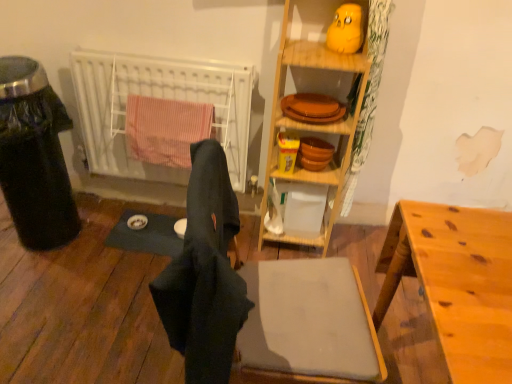
Locate an element on the screen. This screenshot has height=384, width=512. orange matte tray at center is located at coordinates (312, 108).

Find the location of a particular element. white matte radiator at left is located at coordinates (158, 97).

The height and width of the screenshot is (384, 512). Describe the element at coordinates (146, 235) in the screenshot. I see `dark gray fabric yoga mat at center` at that location.

This screenshot has width=512, height=384. Describe the element at coordinates (346, 29) in the screenshot. I see `yellow matte rubber duck at upper center` at that location.

Describe the element at coordinates (311, 124) in the screenshot. This screenshot has width=512, height=384. I see `wooden shelf at upper center` at that location.

Image resolution: width=512 pixels, height=384 pixels. In order to click on matte orange plates at upper center in this screenshot , I will do `click(313, 123)`.

From the image's perspective, is wooden shelf at upper center over dark gray fabric yoga mat at center?

Yes.

Considering the positions of points (302, 12) and (166, 236), is point (302, 12) closer to camera compared to point (166, 236)?

Yes, point (302, 12) is in front of point (166, 236).

Considering the positions of objects wooden shelf at upper center and dark gray fabric yoga mat at center in the image provided, who is more to the left, wooden shelf at upper center or dark gray fabric yoga mat at center?

Positioned to the left is dark gray fabric yoga mat at center.

Is wooden shelf at upper center situated inside dark gray fabric yoga mat at center or outside?

wooden shelf at upper center lies outside dark gray fabric yoga mat at center.

Is yellow matte rubber duck at upper center aimed at dark gray fabric yoga mat at center?

No, yellow matte rubber duck at upper center is not aimed at dark gray fabric yoga mat at center.

Are yellow matte rubber duck at upper center and dark gray fabric yoga mat at center far apart?

yellow matte rubber duck at upper center is far away from dark gray fabric yoga mat at center.

How different are the orientations of yellow matte rubber duck at upper center and dark gray fabric yoga mat at center in degrees?

They differ by 0.437 degrees in their facing directions.

From a real-world perspective, is yellow matte rubber duck at upper center on top of dark gray fabric yoga mat at center?

Yes.

Where is `desk below the wooden shelf at upper center (from the image's perspective)`? Image resolution: width=512 pixels, height=384 pixels. desk below the wooden shelf at upper center (from the image's perspective) is located at coordinates (456, 282).

Considering the points (469, 329) and (310, 26), which point is behind, point (469, 329) or point (310, 26)?

The point (310, 26) is farther.

Does light brown wooden desk at lower right have a smaller size compared to wooden shelf at upper center?

No.

Is light brown wooden desk at lower right to the left of wooden shelf at upper center from the viewer's perspective?

No, light brown wooden desk at lower right is not to the left of wooden shelf at upper center.

Which object is further away from the camera, wooden shelf at upper center or light brown wooden desk at lower right?

wooden shelf at upper center is more distant.

Looking at their sizes, would you say wooden shelf at upper center is wider or thinner than light brown wooden desk at lower right?

In the image, wooden shelf at upper center appears to be more narrow than light brown wooden desk at lower right.

Is wooden shelf at upper center at the right side of light brown wooden desk at lower right?

No.

Is wooden shelf at upper center directly adjacent to light brown wooden desk at lower right?

No.

Does wooden shelf at upper center turn towards transparent plastic trash can at left?

No, wooden shelf at upper center is not turned towards transparent plastic trash can at left.

Which object is positioned more to the right, wooden shelf at upper center or transparent plastic trash can at left?

From the viewer's perspective, wooden shelf at upper center appears more on the right side.

Which of these two, wooden shelf at upper center or transparent plastic trash can at left, stands taller?

wooden shelf at upper center is taller.

From the image's perspective, between wooden shelf at upper center and transparent plastic trash can at left, who is located below?

transparent plastic trash can at left.

Which object is more forward, dark fabric laundry at center or wooden shelf at upper center?

Positioned in front is dark fabric laundry at center.

From the image's perspective, between dark fabric laundry at center and wooden shelf at upper center, which one is located above?

From the image's view, wooden shelf at upper center is above.

Is dark fabric laundry at center spatially inside wooden shelf at upper center, or outside of it?

dark fabric laundry at center is not inside wooden shelf at upper center, it's outside.

Which of these two, dark fabric laundry at center or wooden shelf at upper center, is thinner?

With smaller width is dark fabric laundry at center.

Considering the sizes of dark gray fabric yoga mat at center and matte orange plates at upper center in the image, is dark gray fabric yoga mat at center taller or shorter than matte orange plates at upper center?

Clearly, dark gray fabric yoga mat at center is shorter compared to matte orange plates at upper center.

Considering the positions of objects dark gray fabric yoga mat at center and matte orange plates at upper center in the image provided, who is behind, dark gray fabric yoga mat at center or matte orange plates at upper center?

dark gray fabric yoga mat at center is more distant.

Considering the relative sizes of dark gray fabric yoga mat at center and matte orange plates at upper center in the image provided, is dark gray fabric yoga mat at center smaller than matte orange plates at upper center?

Yes.

Where is `yoga mat on the left of the wooden shelf at upper center`? This screenshot has width=512, height=384. yoga mat on the left of the wooden shelf at upper center is located at coordinates (146, 235).

Where is `toy located above the dark gray fabric yoga mat at center (from the image's perspective)`? toy located above the dark gray fabric yoga mat at center (from the image's perspective) is located at coordinates (346, 29).

Looking at the image, which one is located further to wooden shelf at upper center, transparent plastic trash can at left or light brown wooden desk at lower right?

transparent plastic trash can at left is positioned further to the anchor wooden shelf at upper center.

Consider the image. Estimate the real-world distances between objects in this image. Which object is closer to dark fabric laundry at center, yellow matte rubber duck at upper center or wooden shelf at upper center?

wooden shelf at upper center is positioned closer to the anchor dark fabric laundry at center.

Based on their spatial positions, is orange matte tray at center or white matte radiator at left closer to matte orange plates at upper center?

orange matte tray at center is positioned closer to the anchor matte orange plates at upper center.

Based on the photo, estimate the real-world distances between objects in this image. Which object is further from dark gray fabric yoga mat at center, white matte radiator at left or transparent plastic trash can at left?

white matte radiator at left is further to dark gray fabric yoga mat at center.

From the picture: Which object lies further to the anchor point white matte radiator at left, wooden shelf at upper center or yellow matte rubber duck at upper center?

The object further to white matte radiator at left is yellow matte rubber duck at upper center.

Estimate the real-world distances between objects in this image. Which object is closer to yellow matte rubber duck at upper center, matte orange plates at upper center or wooden shelf at upper center?

The object closer to yellow matte rubber duck at upper center is matte orange plates at upper center.

Based on their spatial positions, is light brown wooden desk at lower right or wooden shelf at upper center closer to white matte radiator at left?

Among the two, wooden shelf at upper center is located nearer to white matte radiator at left.

Estimate the real-world distances between objects in this image. Which object is further from dark gray fabric yoga mat at center, white matte radiator at left or light brown wooden desk at lower right?

light brown wooden desk at lower right lies further to dark gray fabric yoga mat at center than the other object.

Locate an element on the screen. The height and width of the screenshot is (384, 512). radiator situated between transparent plastic trash can at left and matte orange plates at upper center from left to right is located at coordinates (158, 97).

Locate an element on the screen. Image resolution: width=512 pixels, height=384 pixels. cabinetry located between transparent plastic trash can at left and matte orange plates at upper center in the left-right direction is located at coordinates (311, 124).

Locate an element on the screen. Image resolution: width=512 pixels, height=384 pixels. radiator between transparent plastic trash can at left and light brown wooden desk at lower right is located at coordinates coord(158,97).

Where is `cabinetry located between transparent plastic trash can at left and light brown wooden desk at lower right in the left-right direction`? cabinetry located between transparent plastic trash can at left and light brown wooden desk at lower right in the left-right direction is located at coordinates (311, 124).